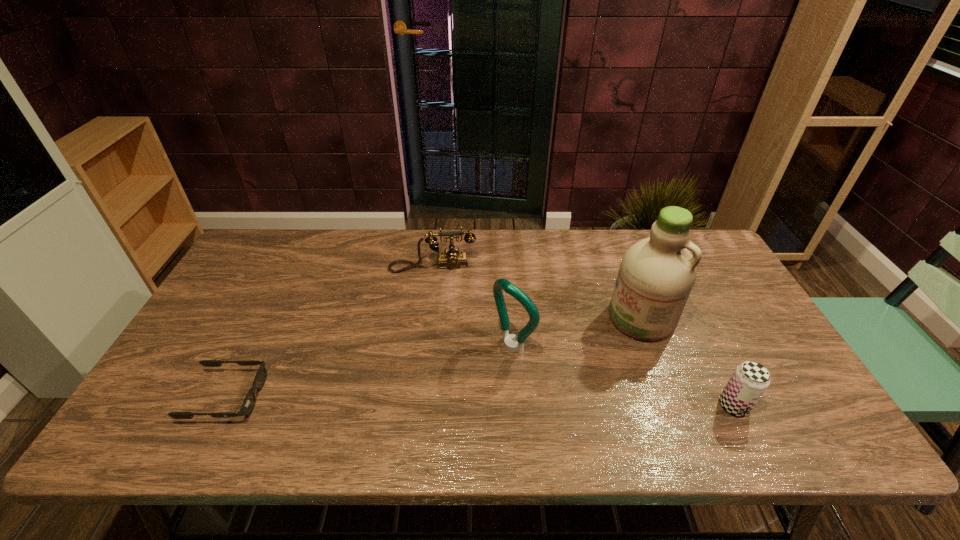
Locate an element on the screen. vacant area that lies between the second object from right to left and the bottle opener is located at coordinates (577, 332).

Identify the location of free space between the rightmost object and the shortest object. (480, 401).

The width and height of the screenshot is (960, 540). I want to click on the fourth closest object to the tallest object, so click(248, 404).

What are the coordinates of `the fourth closest object to the beer can` in the screenshot? It's located at (248, 404).

At what (x,y) coordinates should I click in order to perform the action: click on vacant region that satisfies the following two spatial constraints: 1. on the front side of the telephone; 2. on the left side of the cleansing agent. Please return your answer as a coordinate pair (x, y). The height and width of the screenshot is (540, 960). Looking at the image, I should click on (426, 318).

At what (x,y) coordinates should I click in order to perform the action: click on free space that satisfies the following two spatial constraints: 1. on the front side of the rightmost object; 2. on the right side of the third object from right to left. Please return your answer as a coordinate pair (x, y). This screenshot has width=960, height=540. Looking at the image, I should click on (517, 406).

The image size is (960, 540). What are the coordinates of `blank area in the image that satisfies the following two spatial constraints: 1. on the front side of the tallest object; 2. on the left side of the rightmost object` in the screenshot? It's located at (675, 406).